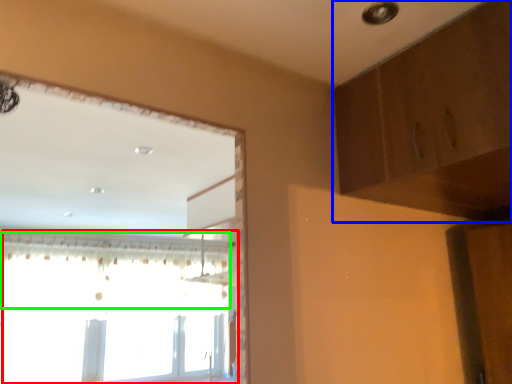
Question: Which object is positioned farthest from window (highlighted by a red box)? Select from dresser (highlighted by a blue box) and curtain (highlighted by a green box).

Choices:
 (A) dresser
 (B) curtain

Answer: (A)